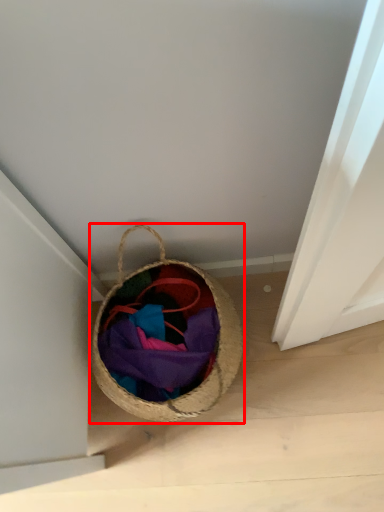
Question: From the image's perspective, considering the relative positions of picnic basket (annotated by the red box) and clothing in the image provided, where is picnic basket (annotated by the red box) located with respect to the staircase?

Choices:
 (A) above
 (B) below

Answer: (A)